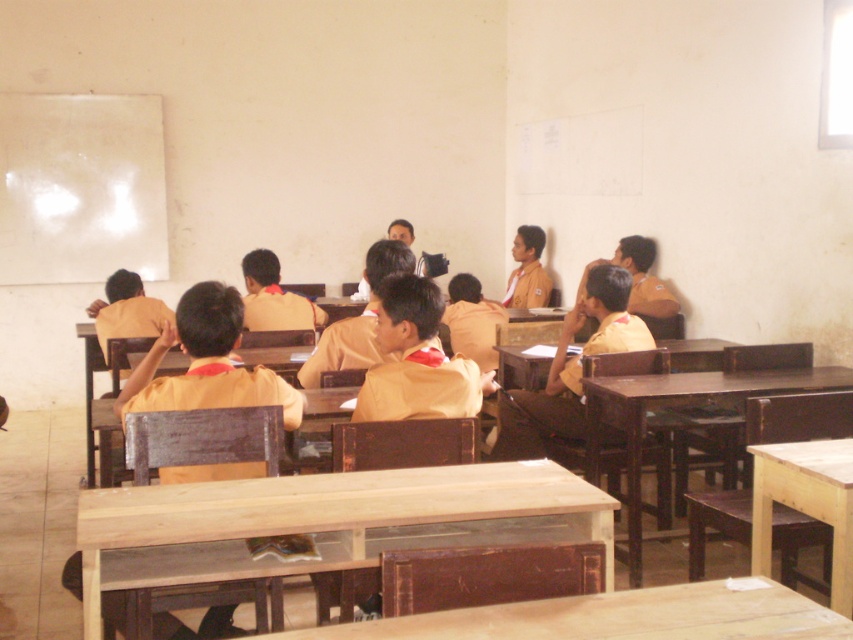
Question: Does light brown wooden table at lower right appear on the left side of brown wooden table at center?

Choices:
 (A) yes
 (B) no

Answer: (A)

Question: Which object is positioned closest to the light brown wooden table at lower center?

Choices:
 (A) light brown wooden table at lower right
 (B) wooden table at center
 (C) matte yellow shirt at center

Answer: (A)

Question: Does light brown wooden table at lower center have a smaller size compared to light brown wooden table at lower right?

Choices:
 (A) no
 (B) yes

Answer: (B)

Question: Can you confirm if light brown wooden table at center is positioned below brown wooden table at center?

Choices:
 (A) no
 (B) yes

Answer: (B)

Question: Which point is farther to the camera?

Choices:
 (A) wooden table at center
 (B) light brown wooden table at lower center
 (C) light brown wooden table at lower right

Answer: (A)

Question: Which point is closer to the camera?

Choices:
 (A) light brown wooden table at center
 (B) wooden table at center
 (C) light brown wooden table at lower center

Answer: (C)